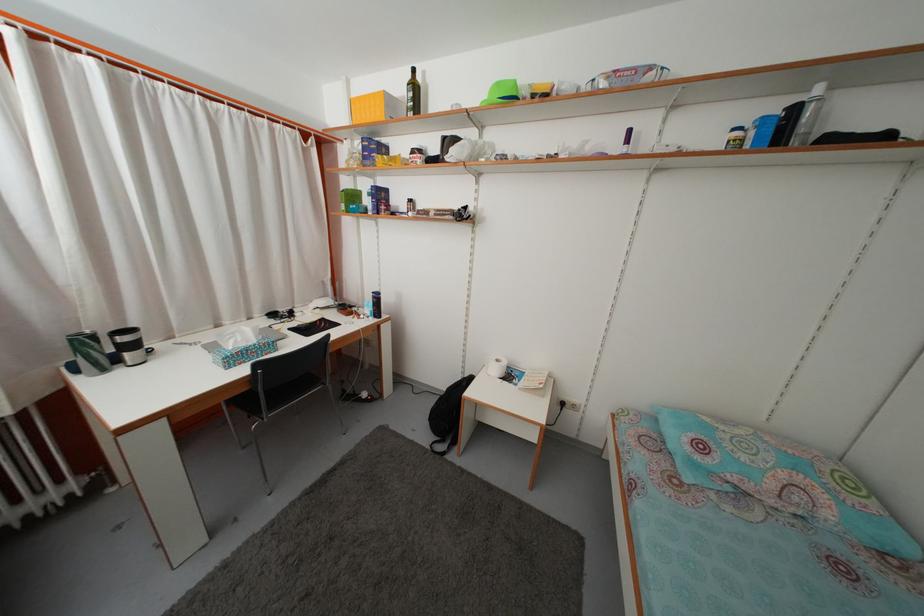
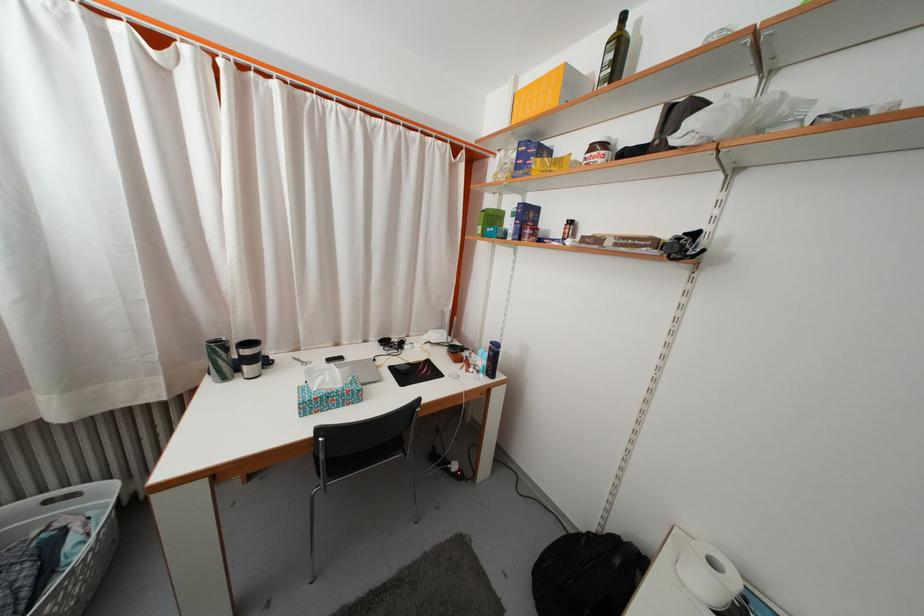
Question: How did the camera likely rotate?

Choices:
 (A) Left
 (B) Right
 (C) Up
 (D) Down

Answer: (A)